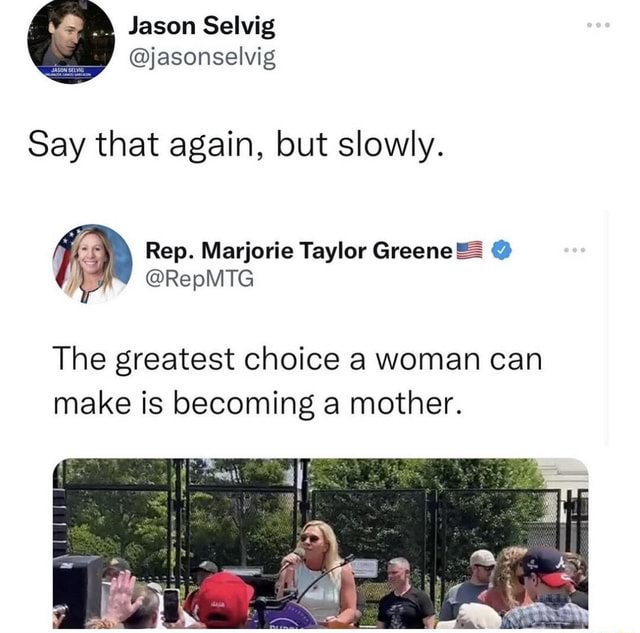
In order to click on speaker in this screenshot , I will do `click(66, 586)`, `click(59, 514)`.